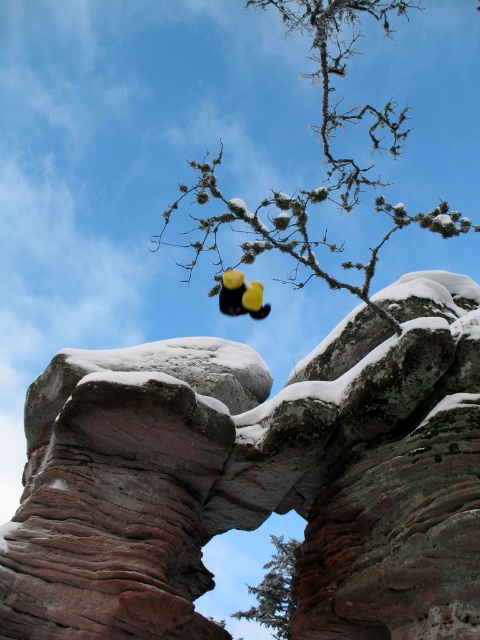
Who is shorter, snow-covered branches at center or green textured tree at center?

With less height is green textured tree at center.

Identify the location of snow-covered branches at center. (324, 161).

Where is `snow-covered branches at center`? snow-covered branches at center is located at coordinates (324, 161).

Does rustic stone arch at center have a greater height compared to green textured tree at center?

In fact, rustic stone arch at center may be shorter than green textured tree at center.

Is point (67, 550) positioned in front of point (282, 598)?

Yes.

This screenshot has width=480, height=640. I want to click on rustic stone arch at center, so click(256, 477).

Can you confirm if snow-covered branches at center is positioned above yellow matte duck at center?

Yes.

This screenshot has height=640, width=480. In order to click on snow-covered branches at center in this screenshot , I will do `click(324, 161)`.

Which is behind, point (216, 227) or point (250, 291)?

Positioned behind is point (250, 291).

This screenshot has height=640, width=480. Find the location of `snow-covered branches at center`. snow-covered branches at center is located at coordinates (324, 161).